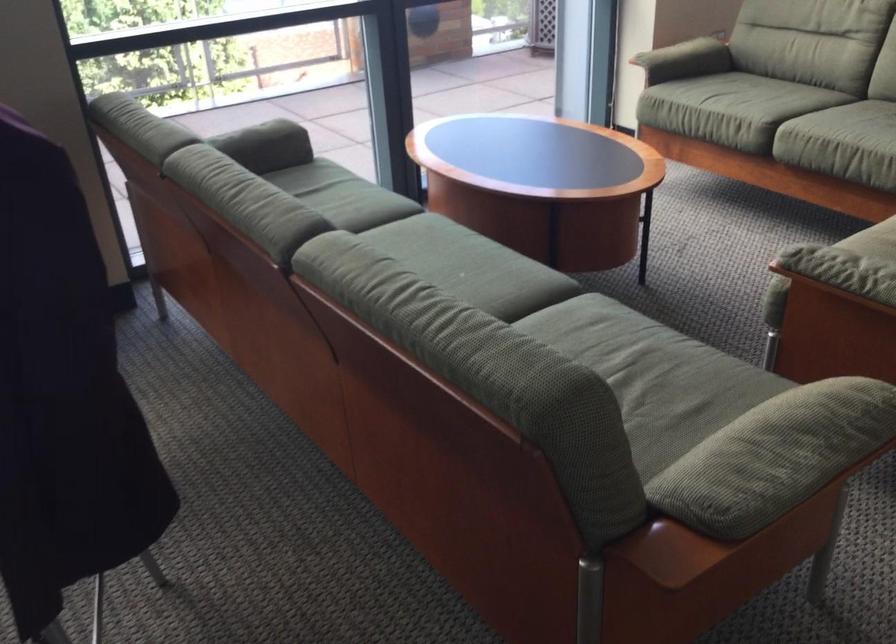
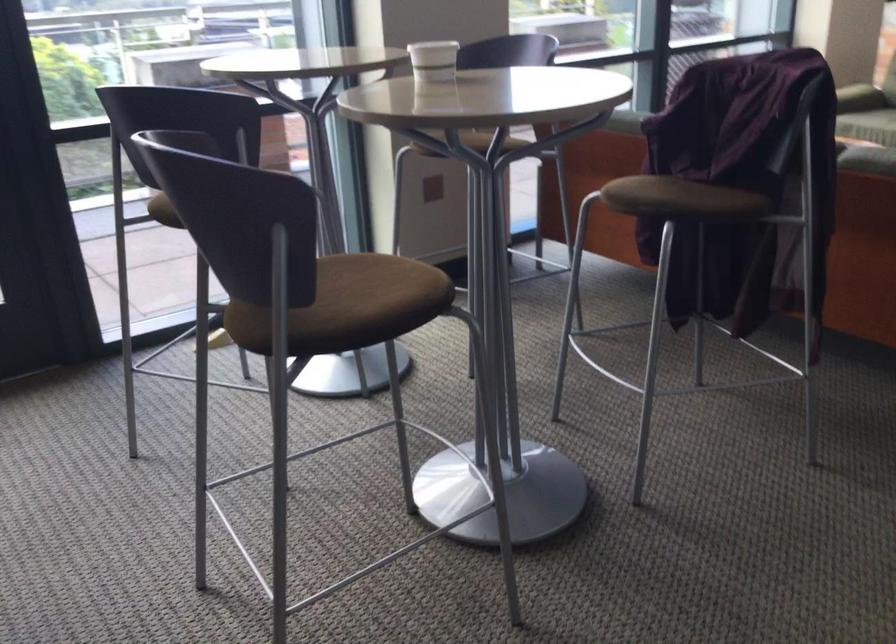
Question: I am providing you with two images of the same scene from different viewpoints. Please identify which objects are invisible in image2.

Choices:
 (A) blue power switch
 (B) white paper cup
 (C) green sofa armrest
 (D) brown chair sitting surface

Answer: (C)